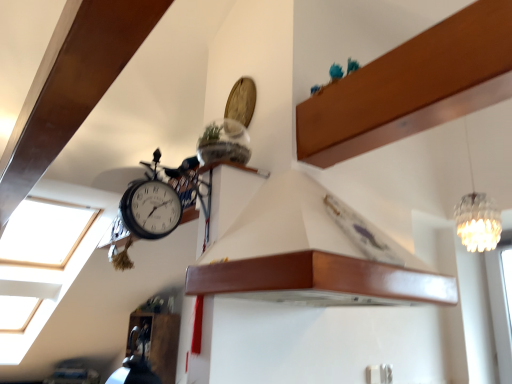
The height and width of the screenshot is (384, 512). What do you see at coordinates (161, 342) in the screenshot?
I see `wooden shelf at lower left` at bounding box center [161, 342].

This screenshot has width=512, height=384. I want to click on wooden shelf at lower left, so (x=161, y=342).

You are a GUI agent. You are given a task and a screenshot of the screen. Output one action in this format:
    pyautogui.click(x=<x>, y=<y>)
    Task: Click on the wooden shelf at lower left
    
    Given the screenshot: What is the action you would take?
    pyautogui.click(x=161, y=342)